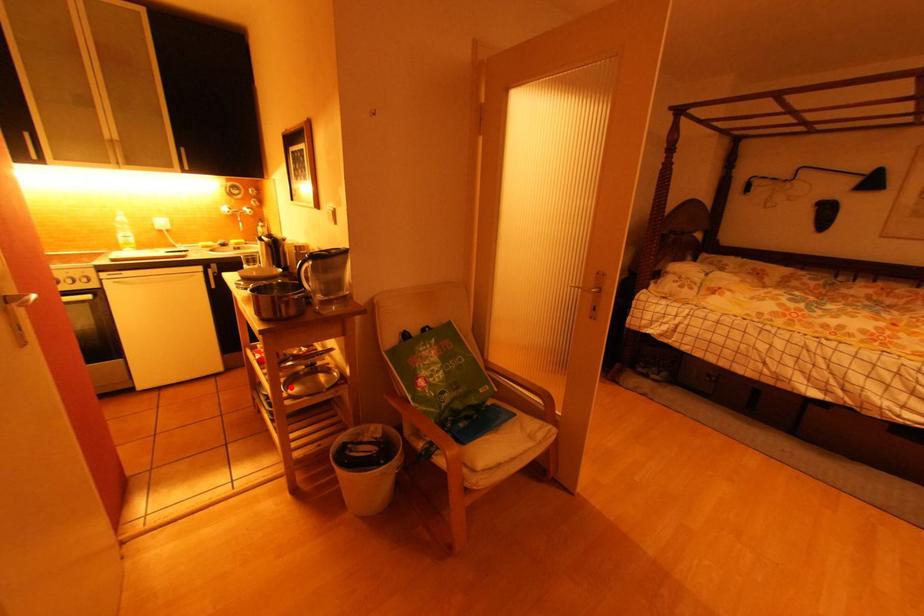
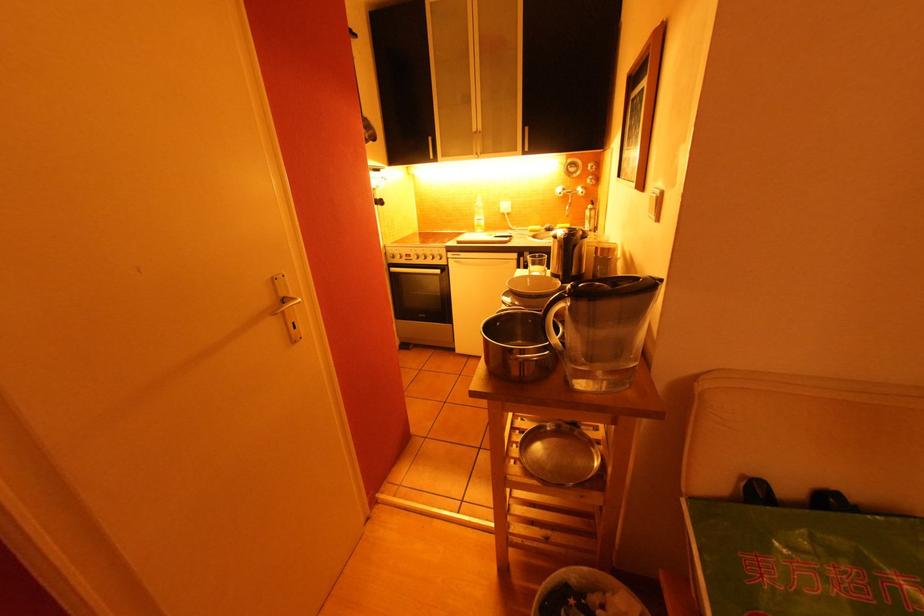
The point at the highlighted location is marked in the first image. Where is the corresponding point in the second image?

(535, 440)